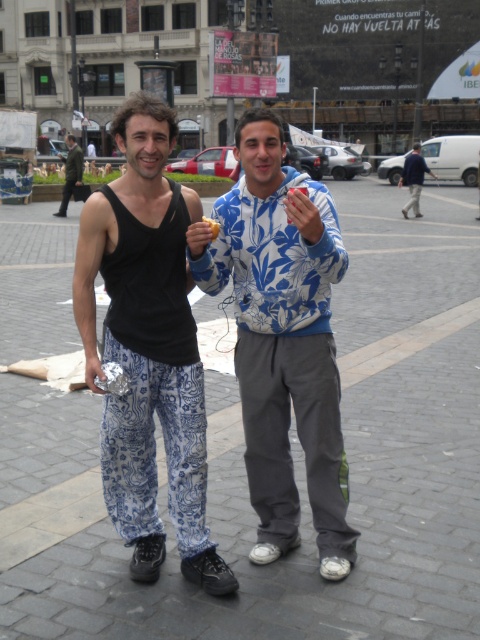
You are a photographer trying to capture a photo of the black cotton tank top at center and the matte black hand at center. Which object should you focus on first if you want to ensure both are in the frame?

The black cotton tank top at center is to the left of matte black hand at center. Since the tank top is on the left, you should focus on it first to ensure both are in the frame.